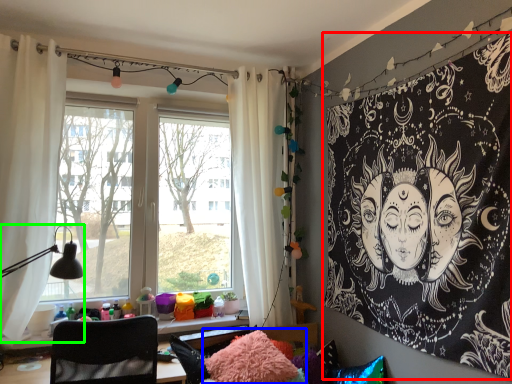
Question: Which object is positioned farthest from bulletin board (highlighted by a red box)? Select from pillow (highlighted by a blue box) and table lamp (highlighted by a green box).

Choices:
 (A) pillow
 (B) table lamp

Answer: (B)